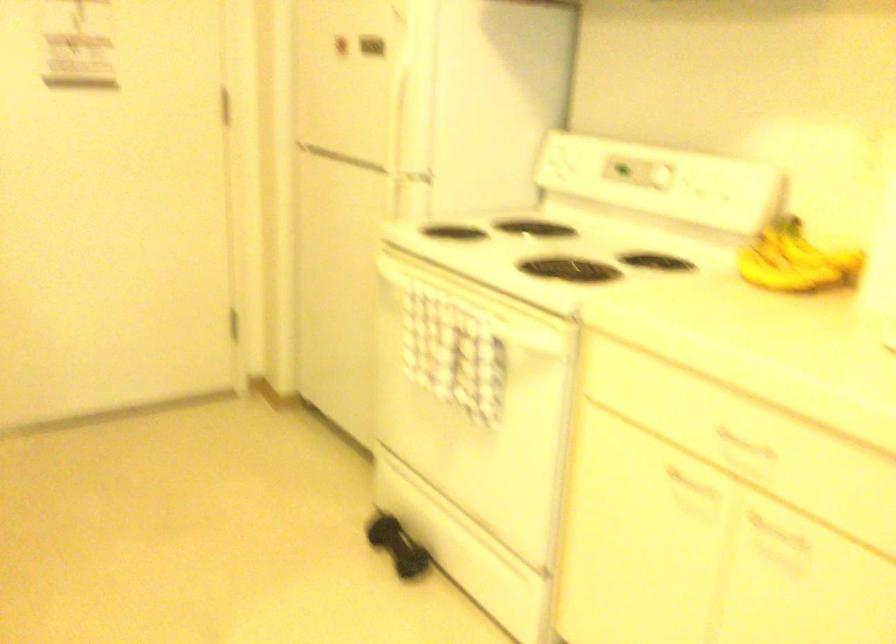
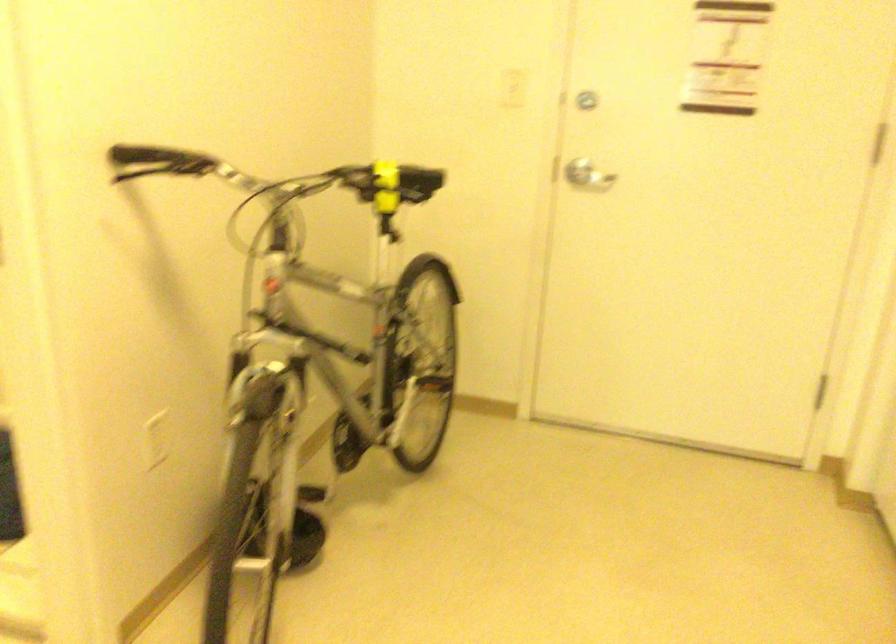
Question: The images are taken continuously from a first-person perspective. In which direction is your viewpoint rotating?

Choices:
 (A) Left
 (B) Right
 (C) Up
 (D) Down

Answer: (A)